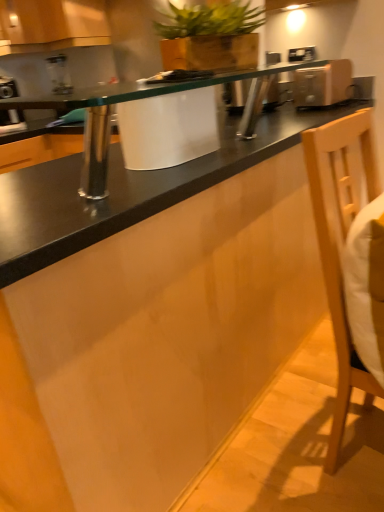
Describe the element at coordinates (140, 90) in the screenshot. This screenshot has width=384, height=512. I see `black glass countertop at center` at that location.

What do you see at coordinates (341, 242) in the screenshot? I see `light wood swivel chair at right` at bounding box center [341, 242].

What do you see at coordinates (8, 88) in the screenshot? This screenshot has width=384, height=512. I see `metallic silver toaster at upper left, the first appliance viewed from the back` at bounding box center [8, 88].

The image size is (384, 512). What do you see at coordinates (323, 84) in the screenshot?
I see `satin gold toaster at upper right, which ranks as the second appliance in back-to-front order` at bounding box center [323, 84].

Where is `wooden planter at upper center`? wooden planter at upper center is located at coordinates (210, 37).

Where is `wooden cabinet at upper left`? Image resolution: width=384 pixels, height=512 pixels. wooden cabinet at upper left is located at coordinates (51, 25).

Could you tell me if wooden planter at upper center is turned towards wooden cabinet at upper left?

Yes.

From the image's perspective, is wooden planter at upper center beneath wooden cabinet at upper left?

Indeed, from the image's perspective, wooden planter at upper center is shown beneath wooden cabinet at upper left.

Which object is further away from the camera, wooden planter at upper center or wooden cabinet at upper left?

wooden cabinet at upper left is further away from the camera.

Measure the distance from wooden planter at upper center to wooden cabinet at upper left.

wooden planter at upper center is 35.55 inches away from wooden cabinet at upper left.

Between light wood swivel chair at right and black glass countertop at center, which one has smaller size?

black glass countertop at center.

Where is `countertop on the left of light wood swivel chair at right`? countertop on the left of light wood swivel chair at right is located at coordinates (140, 90).

Is light wood swivel chair at right not within black glass countertop at center?

Indeed, light wood swivel chair at right is completely outside black glass countertop at center.

Considering the sizes of objects light wood swivel chair at right and black glass countertop at center in the image provided, who is wider, light wood swivel chair at right or black glass countertop at center?

light wood swivel chair at right.

Based on the photo, how far apart are black glass countertop at center and metallic silver toaster at upper left, arranged as the 1th appliance when viewed from the left?

They are 1.57 meters apart.

From the image's perspective, between black glass countertop at center and metallic silver toaster at upper left, arranged as the 1th appliance when viewed from the left, who is located below?

black glass countertop at center, from the image's perspective.

Which of these two, black glass countertop at center or metallic silver toaster at upper left, which ranks as the second appliance in right-to-left order, is bigger?

black glass countertop at center.

Is metallic silver toaster at upper left, the second appliance positioned from the front, aimed at satin gold toaster at upper right, marked as the second appliance in a left-to-right arrangement?

No.

From a real-world perspective, is metallic silver toaster at upper left, the first appliance viewed from the back, positioned over satin gold toaster at upper right, marked as the second appliance in a left-to-right arrangement, based on gravity?

Yes, from a real-world perspective, metallic silver toaster at upper left, the first appliance viewed from the back, is on top of satin gold toaster at upper right, marked as the second appliance in a left-to-right arrangement.

Which is closer, (4, 88) or (351, 64)?

The point (4, 88) is in front.

Is satin gold toaster at upper right, the 1th appliance from the right, a part of metallic silver toaster at upper left, which ranks as the second appliance in right-to-left order?

No, metallic silver toaster at upper left, which ranks as the second appliance in right-to-left order, does not contain satin gold toaster at upper right, the 1th appliance from the right.

Is light wood swivel chair at right taller than satin gold toaster at upper right, which ranks as the second appliance in back-to-front order?

Correct, light wood swivel chair at right is much taller as satin gold toaster at upper right, which ranks as the second appliance in back-to-front order.

The width and height of the screenshot is (384, 512). What are the coordinates of `the 1st appliance behind the light wood swivel chair at right, counting from the anchor's position` in the screenshot? It's located at (323, 84).

Between wooden planter at upper center and light wood swivel chair at right, which one has larger size?

Bigger between the two is light wood swivel chair at right.

Is wooden planter at upper center beside light wood swivel chair at right?

No.

Is wooden planter at upper center at the left side of light wood swivel chair at right?

Indeed, wooden planter at upper center is positioned on the left side of light wood swivel chair at right.

In the scene shown: From the image's perspective, is wooden planter at upper center above light wood swivel chair at right?

Yes.

Are satin gold toaster at upper right, the 1th appliance viewed from the front, and metallic silver toaster at upper left, which ranks as the second appliance in right-to-left order, far apart?

Yes, satin gold toaster at upper right, the 1th appliance viewed from the front, and metallic silver toaster at upper left, which ranks as the second appliance in right-to-left order, are quite far apart.

Is satin gold toaster at upper right, marked as the second appliance in a left-to-right arrangement, turned away from metallic silver toaster at upper left, which ranks as the second appliance in right-to-left order?

No, satin gold toaster at upper right, marked as the second appliance in a left-to-right arrangement, is not facing away from metallic silver toaster at upper left, which ranks as the second appliance in right-to-left order.

In the image, is satin gold toaster at upper right, the 1th appliance viewed from the front, on the left side or the right side of metallic silver toaster at upper left, the second appliance positioned from the front?

Based on their positions, satin gold toaster at upper right, the 1th appliance viewed from the front, is located to the right of metallic silver toaster at upper left, the second appliance positioned from the front.

From a real-world perspective, is satin gold toaster at upper right, which ranks as the second appliance in back-to-front order, physically below metallic silver toaster at upper left, the second appliance positioned from the front?

Yes, from a real-world perspective, satin gold toaster at upper right, which ranks as the second appliance in back-to-front order, is beneath metallic silver toaster at upper left, the second appliance positioned from the front.

The height and width of the screenshot is (512, 384). What are the coordinates of `cabinetry behind the wooden planter at upper center` in the screenshot? It's located at (51, 25).

Where is `swivel chair that is on the right side of black glass countertop at center`? The width and height of the screenshot is (384, 512). swivel chair that is on the right side of black glass countertop at center is located at coordinates (341, 242).

Based on their spatial positions, is wooden cabinet at upper left or light wood swivel chair at right closer to wooden planter at upper center?

wooden cabinet at upper left.

From the image, which object appears to be farther from wooden cabinet at upper left, wooden planter at upper center or satin gold toaster at upper right, marked as the second appliance in a left-to-right arrangement?

satin gold toaster at upper right, marked as the second appliance in a left-to-right arrangement, is positioned further to the anchor wooden cabinet at upper left.

Estimate the real-world distances between objects in this image. Which object is closer to wooden planter at upper center, black glass countertop at center or wooden cabinet at upper left?

The object closer to wooden planter at upper center is wooden cabinet at upper left.

From the picture: Which object lies nearer to the anchor point wooden cabinet at upper left, light wood swivel chair at right or metallic silver toaster at upper left, arranged as the 1th appliance when viewed from the left?

metallic silver toaster at upper left, arranged as the 1th appliance when viewed from the left, is positioned closer to the anchor wooden cabinet at upper left.

Which object lies nearer to the anchor point light wood swivel chair at right, satin gold toaster at upper right, the 1th appliance viewed from the front, or black glass countertop at center?

Among the two, black glass countertop at center is located nearer to light wood swivel chair at right.

When comparing their distances from metallic silver toaster at upper left, arranged as the 1th appliance when viewed from the left, does wooden cabinet at upper left or satin gold toaster at upper right, which ranks as the second appliance in back-to-front order, seem closer?

wooden cabinet at upper left is closer to metallic silver toaster at upper left, arranged as the 1th appliance when viewed from the left.

Which object lies further to the anchor point black glass countertop at center, satin gold toaster at upper right, which ranks as the second appliance in back-to-front order, or metallic silver toaster at upper left, arranged as the 1th appliance when viewed from the left?

The object further to black glass countertop at center is metallic silver toaster at upper left, arranged as the 1th appliance when viewed from the left.

From the image, which object appears to be farther from light wood swivel chair at right, black glass countertop at center or satin gold toaster at upper right, marked as the second appliance in a left-to-right arrangement?

Among the two, satin gold toaster at upper right, marked as the second appliance in a left-to-right arrangement, is located further to light wood swivel chair at right.

Locate an element on the screen. The width and height of the screenshot is (384, 512). houseplant between metallic silver toaster at upper left, which ranks as the second appliance in right-to-left order, and satin gold toaster at upper right, which ranks as the second appliance in back-to-front order, from left to right is located at coordinates (210, 37).

Where is `houseplant positioned between black glass countertop at center and metallic silver toaster at upper left, arranged as the 1th appliance when viewed from the left, from near to far`? The width and height of the screenshot is (384, 512). houseplant positioned between black glass countertop at center and metallic silver toaster at upper left, arranged as the 1th appliance when viewed from the left, from near to far is located at coordinates (210, 37).

Locate an element on the screen. cabinetry positioned between light wood swivel chair at right and metallic silver toaster at upper left, the first appliance viewed from the back, from near to far is located at coordinates (51, 25).

This screenshot has height=512, width=384. I want to click on houseplant between light wood swivel chair at right and wooden cabinet at upper left along the z-axis, so click(210, 37).